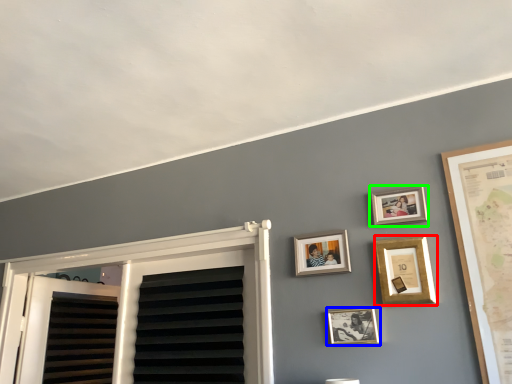
Question: Estimate the real-world distances between objects in this image. Which object is farther from picture frame (highlighted by a red box), picture frame (highlighted by a blue box) or picture frame (highlighted by a green box)?

Choices:
 (A) picture frame
 (B) picture frame

Answer: (A)